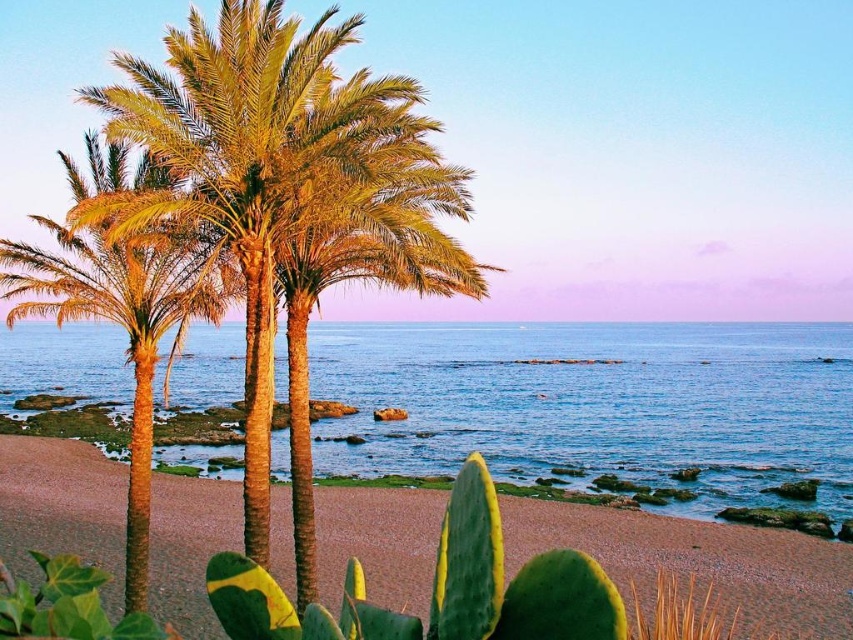
Question: Does blue water at center lie behind green leafy palm trees at center?

Choices:
 (A) yes
 (B) no

Answer: (A)

Question: Can you confirm if blue water at center is smaller than brown sandy beach at center?

Choices:
 (A) yes
 (B) no

Answer: (B)

Question: Which point is closer to the camera?

Choices:
 (A) brown sandy beach at center
 (B) blue water at center

Answer: (A)

Question: Which is nearer to the blue water at center?

Choices:
 (A) green leafy palm trees at center
 (B) brown sandy beach at center

Answer: (B)

Question: Is blue water at center bigger than brown sandy beach at center?

Choices:
 (A) yes
 (B) no

Answer: (A)

Question: Which point appears closest to the camera in this image?

Choices:
 (A) (643, 476)
 (B) (370, 552)

Answer: (B)